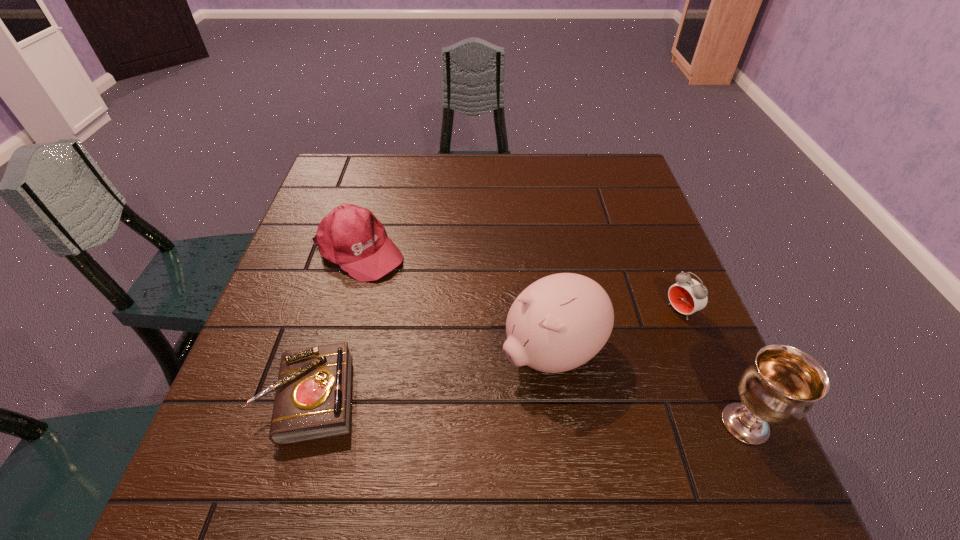
The image size is (960, 540). Identify the location of the second closest object to the alarm clock. (781, 385).

Where is `the fourth closest object to the baseball cap`? The image size is (960, 540). the fourth closest object to the baseball cap is located at coordinates (781, 385).

Find the location of a particular element. vacant position in the image that satisfies the following two spatial constraints: 1. on the back side of the shortest object; 2. on the right side of the baseball cap is located at coordinates (353, 252).

This screenshot has width=960, height=540. In order to click on free region that satisfies the following two spatial constraints: 1. on the back side of the piggy bank; 2. on the left side of the alarm clock in this screenshot , I will do `click(546, 311)`.

Find the location of a particular element. The width and height of the screenshot is (960, 540). free space that satisfies the following two spatial constraints: 1. on the front side of the chalice; 2. on the right side of the diary is located at coordinates (302, 423).

Locate an element on the screen. free location that satisfies the following two spatial constraints: 1. on the front side of the chalice; 2. on the left side of the alarm clock is located at coordinates (727, 423).

Locate an element on the screen. free space that satisfies the following two spatial constraints: 1. on the back side of the piggy bank; 2. on the right side of the alarm clock is located at coordinates (546, 311).